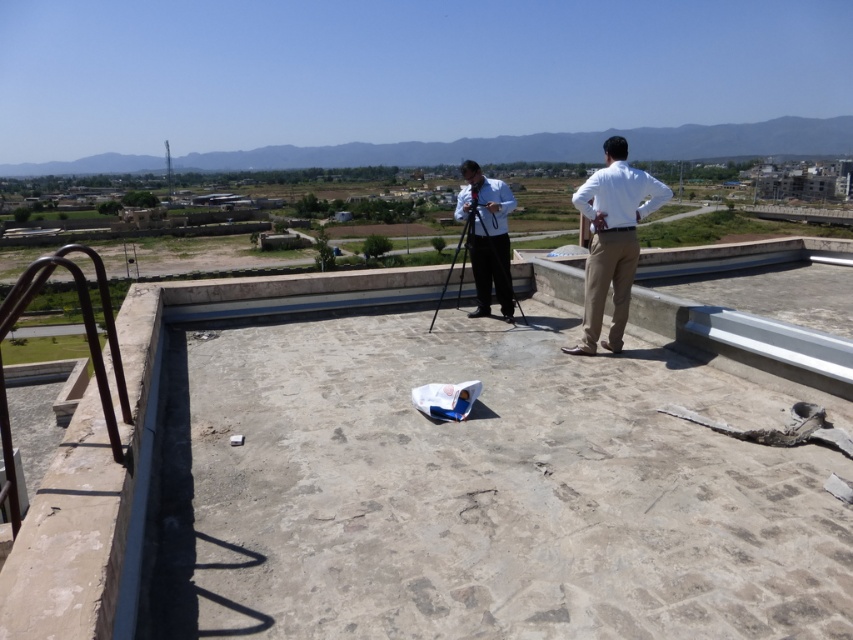
Between white cotton shirt at right and metallic tripod at center, which one has less height?

Standing shorter between the two is white cotton shirt at right.

Can you confirm if white cotton shirt at right is positioned below metallic tripod at center?

Yes.

Who is more distant from viewer, (627, 209) or (454, 250)?

The point (454, 250) is behind.

Where is `white cotton shirt at right`? This screenshot has width=853, height=640. white cotton shirt at right is located at coordinates (612, 241).